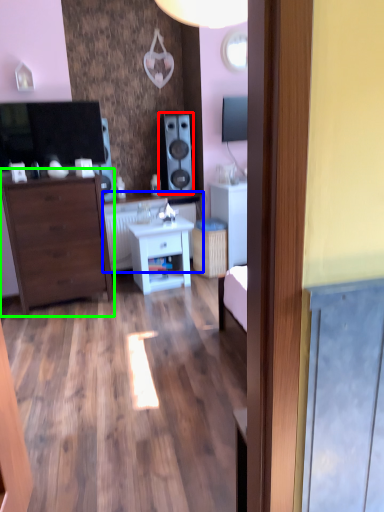
Question: Which object is the farthest from speaker (highlighted by a red box)? Choose among these: counter top (highlighted by a blue box) or chest of drawers (highlighted by a green box).

Choices:
 (A) counter top
 (B) chest of drawers

Answer: (B)